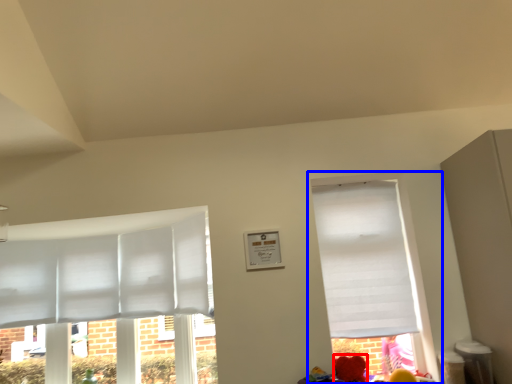
Question: Which object appears closest to the camera in this image, flower (highlighted by a red box) or window (highlighted by a blue box)?

Choices:
 (A) flower
 (B) window

Answer: (A)